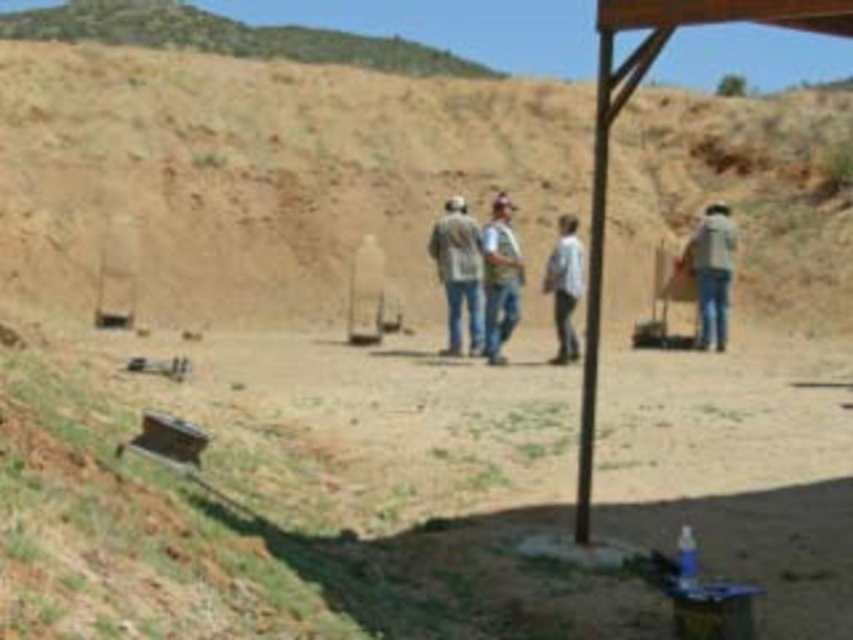
Between dull brown dirt at center and wooden frame at upper right, which one appears on the left side from the viewer's perspective?

From the viewer's perspective, dull brown dirt at center appears more on the left side.

Can you confirm if dull brown dirt at center is positioned below wooden frame at upper right?

Yes.

Is point (646, 624) less distant than point (583, 512)?

Yes.

Where is `dull brown dirt at center`? The height and width of the screenshot is (640, 853). dull brown dirt at center is located at coordinates (292, 496).

Who is shorter, dull brown dirt at center or brown dirt hillside at upper center?

Standing shorter between the two is dull brown dirt at center.

Can you confirm if dull brown dirt at center is bigger than brown dirt hillside at upper center?

Incorrect, dull brown dirt at center is not larger than brown dirt hillside at upper center.

Is point (573, 397) closer to camera compared to point (721, 108)?

Yes.

Locate an element on the screen. Image resolution: width=853 pixels, height=640 pixels. dull brown dirt at center is located at coordinates (292, 496).

Does denim jeans at center have a smaller size compared to white cotton shirt at center?

No, denim jeans at center is not smaller than white cotton shirt at center.

Is denim jeans at center below white cotton shirt at center?

Correct, denim jeans at center is located below white cotton shirt at center.

Find the location of `denim jeans at center`. denim jeans at center is located at coordinates pyautogui.click(x=500, y=278).